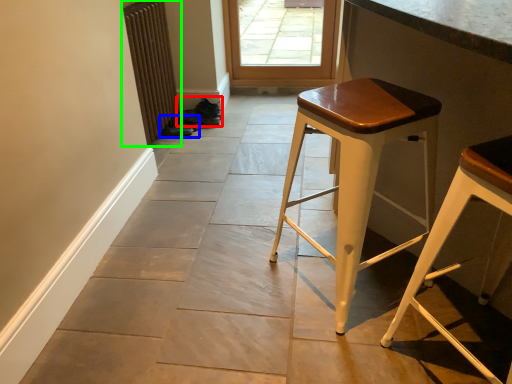
Question: Which is nearer to the shoe (highlighted by a red box)? shoe (highlighted by a blue box) or radiator (highlighted by a green box).

Choices:
 (A) shoe
 (B) radiator

Answer: (A)